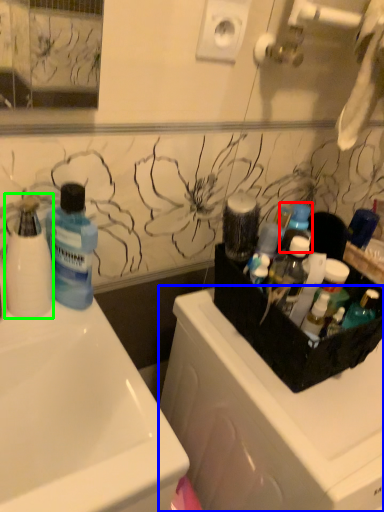
Question: Considering the real-world distances, which object is closest to toiletry (highlighted by a red box)? dish washer (highlighted by a blue box) or cleaning product (highlighted by a green box).

Choices:
 (A) dish washer
 (B) cleaning product

Answer: (A)